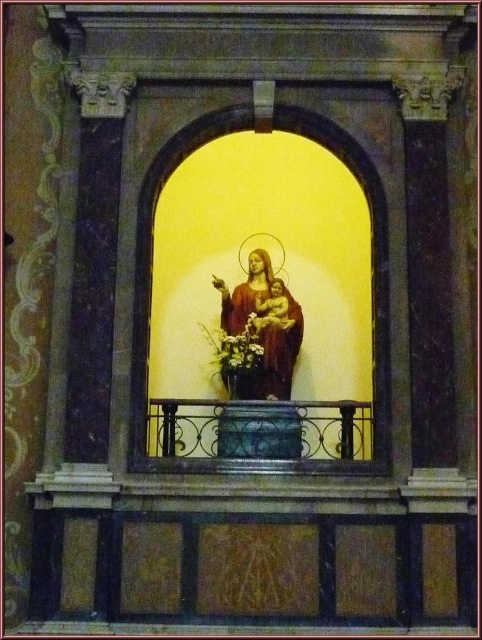
Question: Which object is farther from the camera taking this photo?

Choices:
 (A) black wrought iron balcony at center
 (B) yellow matte flower at center

Answer: (B)

Question: Which point is farther to the camera?

Choices:
 (A) (238, 342)
 (B) (235, 449)

Answer: (A)

Question: Can you confirm if black wrought iron balcony at center is positioned to the left of yellow matte flower at center?

Choices:
 (A) yes
 (B) no

Answer: (B)

Question: Is black wrought iron balcony at center bigger than yellow matte flower at center?

Choices:
 (A) yes
 (B) no

Answer: (A)

Question: Does black wrought iron balcony at center have a greater width compared to yellow matte flower at center?

Choices:
 (A) no
 (B) yes

Answer: (B)